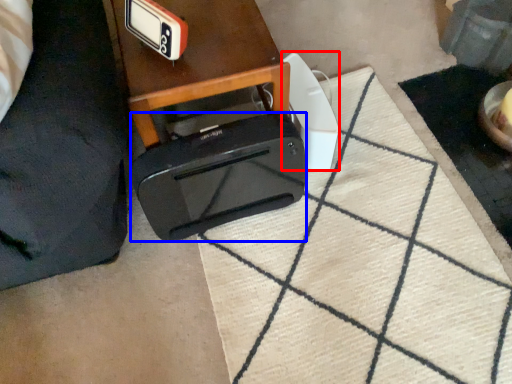
Question: Which point is closer to the camera, appliance (highlighted by a red box) or toaster (highlighted by a blue box)?

Choices:
 (A) appliance
 (B) toaster

Answer: (B)